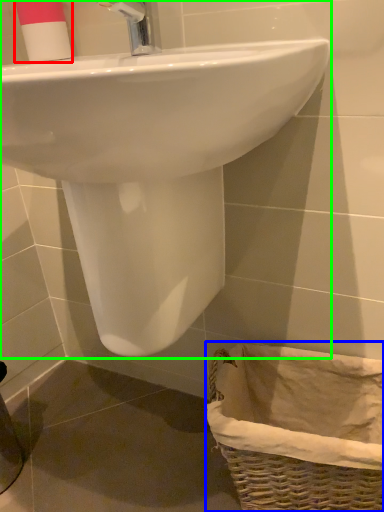
Question: Which is farther away from toiletry (highlighted by a red box)? basket (highlighted by a blue box) or sink (highlighted by a green box)?

Choices:
 (A) basket
 (B) sink

Answer: (A)